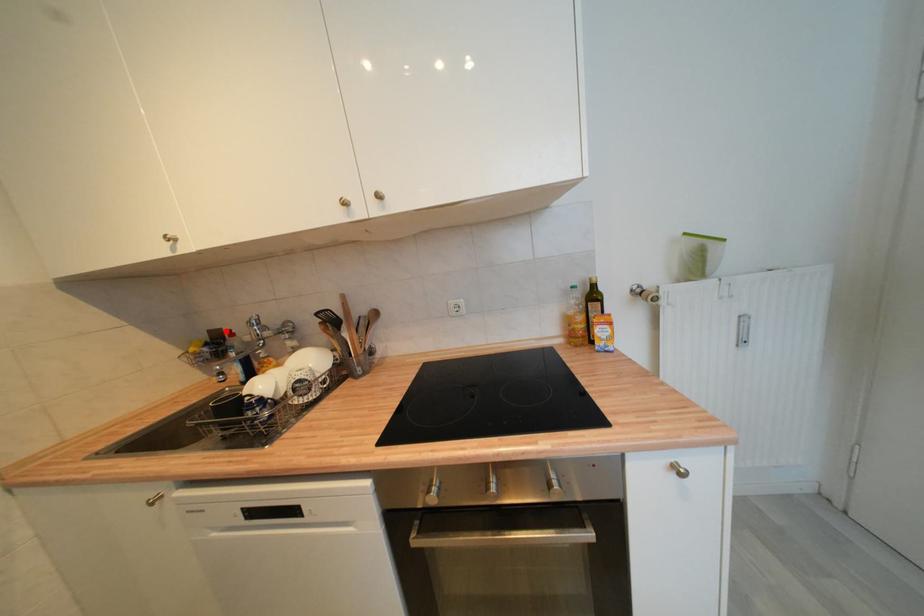
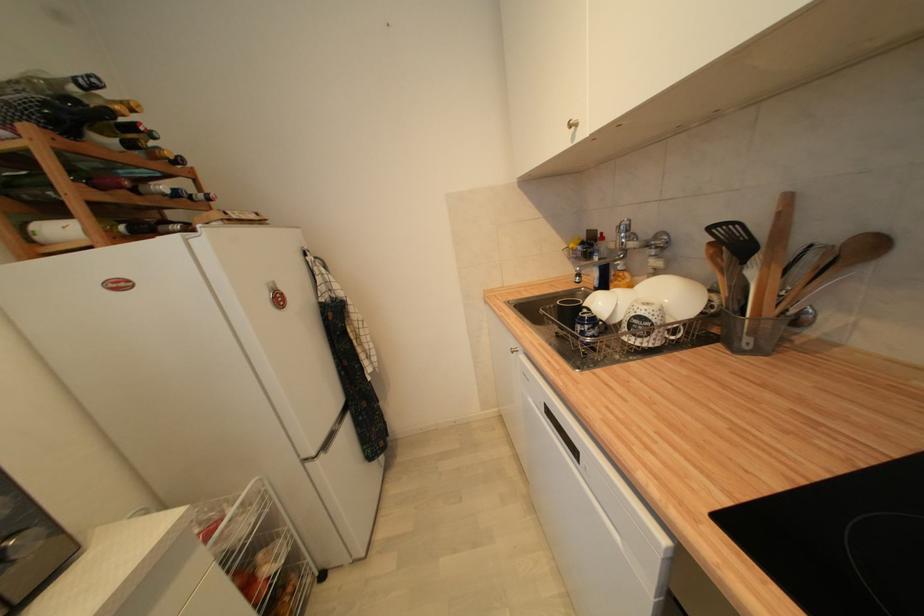
Where in the second image is the point corresponding to the highlighted location from the first image?

(602, 233)